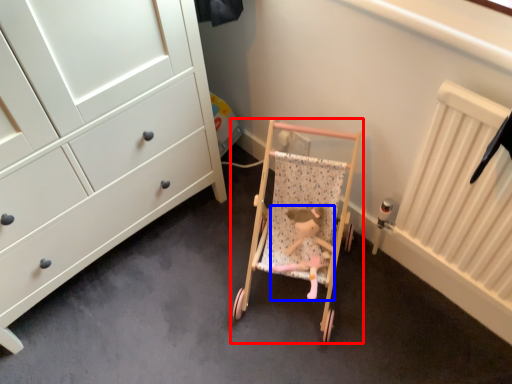
Question: Among these objects, which one is farthest to the camera, furniture (highlighted by a red box) or toy (highlighted by a blue box)?

Choices:
 (A) furniture
 (B) toy

Answer: (B)